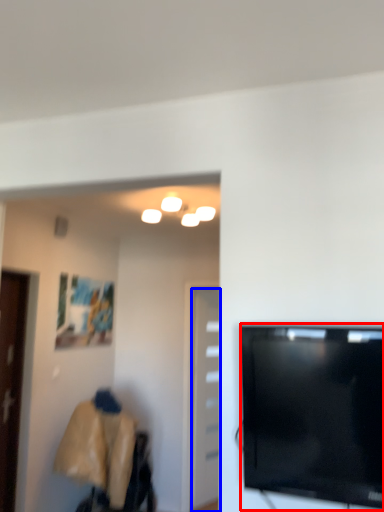
Question: Which of the following is the farthest to the observer, television (highlighted by a red box) or door (highlighted by a blue box)?

Choices:
 (A) television
 (B) door

Answer: (B)